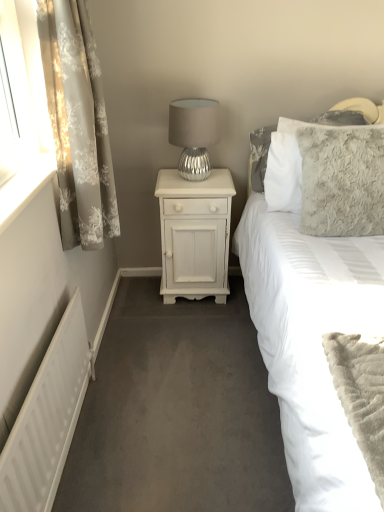
This screenshot has width=384, height=512. Find the location of `vacant space underneath floral sheer curtain at left (from a real-world perspective)`. vacant space underneath floral sheer curtain at left (from a real-world perspective) is located at coordinates (113, 352).